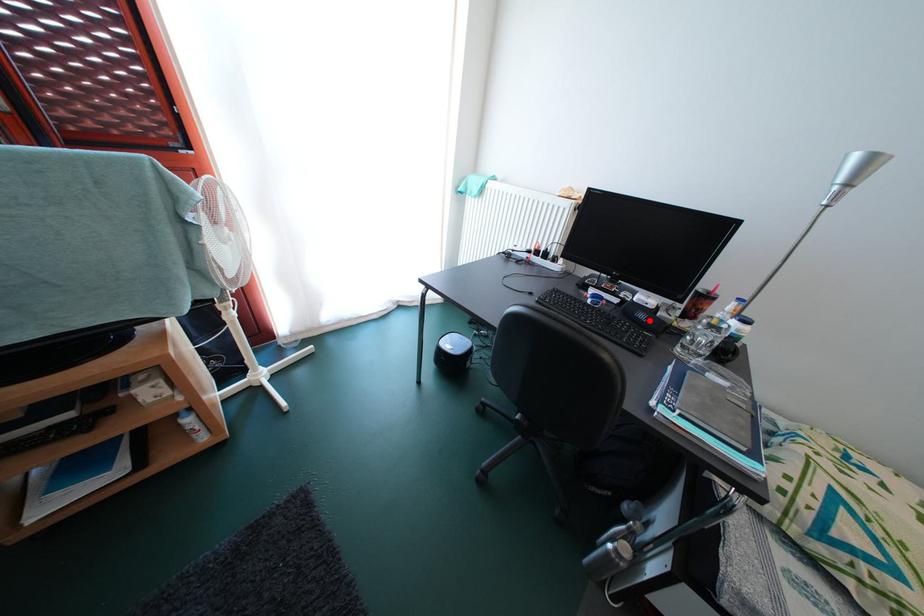
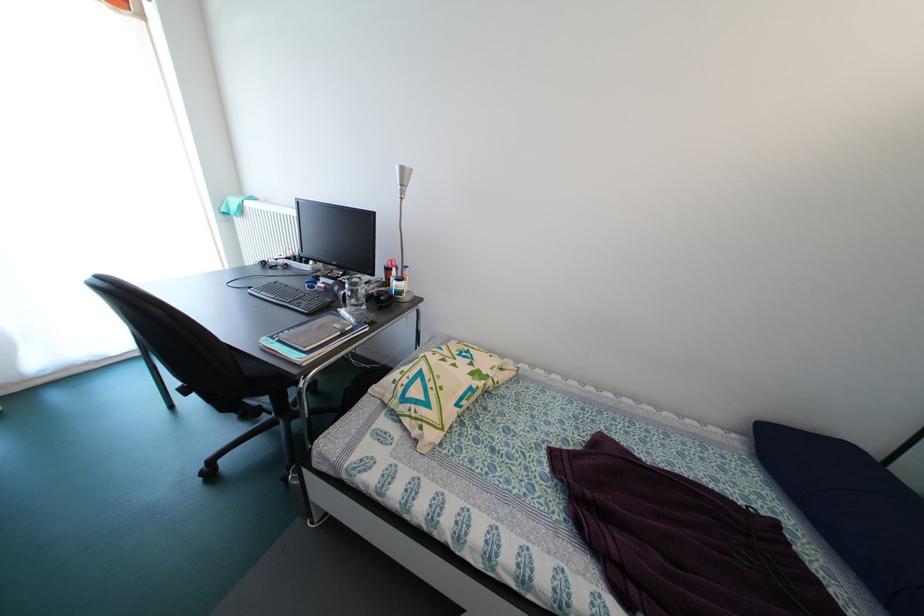
Find the pixel in the second image that matches the highlighted location in the first image.

(344, 294)